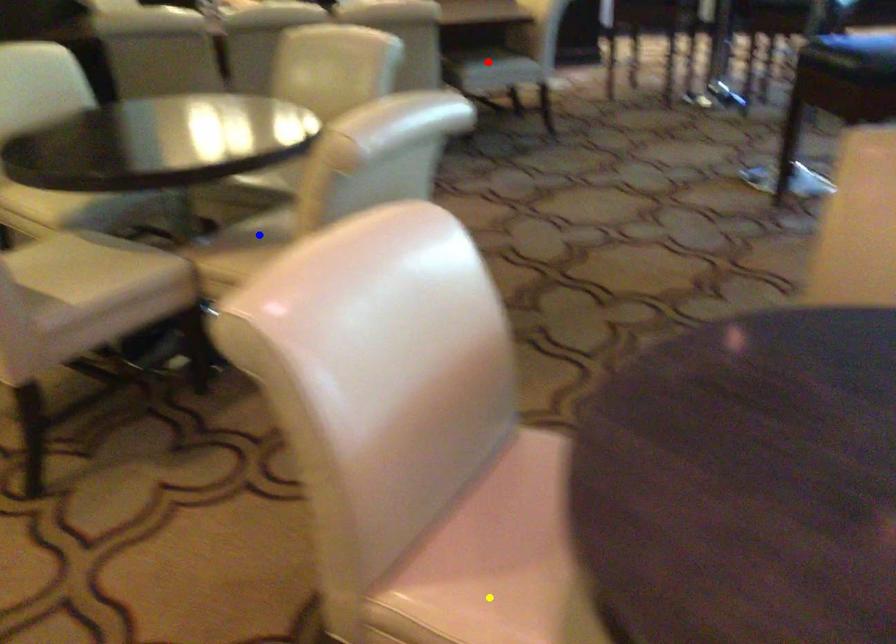
Order these from nearest to farthest:
blue point
yellow point
red point

yellow point, blue point, red point